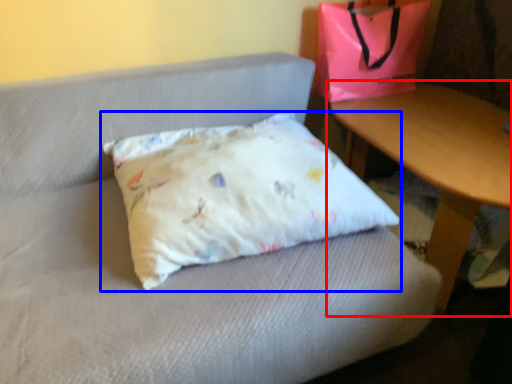
Question: Among these objects, which one is farthest to the camera, table (highlighted by a red box) or pillow (highlighted by a blue box)?

Choices:
 (A) table
 (B) pillow

Answer: (A)